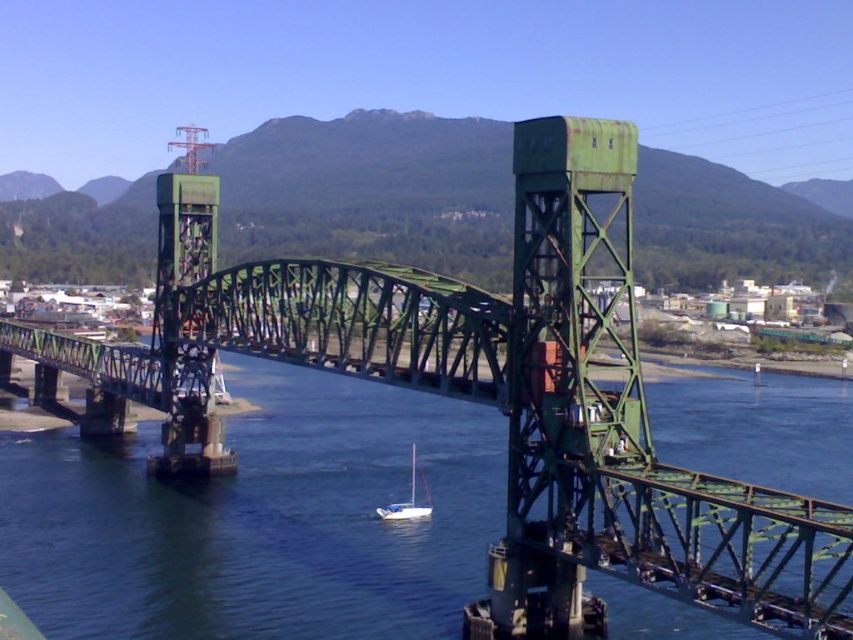
You are standing on the green drawbridge and looking down. Which object is closer to you between the blue water at center and the white matte sailboat at center?

The blue water at center is closer to you because it is in front of the white matte sailboat at center.

You are standing on the drawbridge and want to find the blue water at center. According to the coordinates provided, where should you look relative to your position?

The blue water at center is located at coordinates point (x=260, y=520), so you should look towards the lower middle area of the bridge structure.